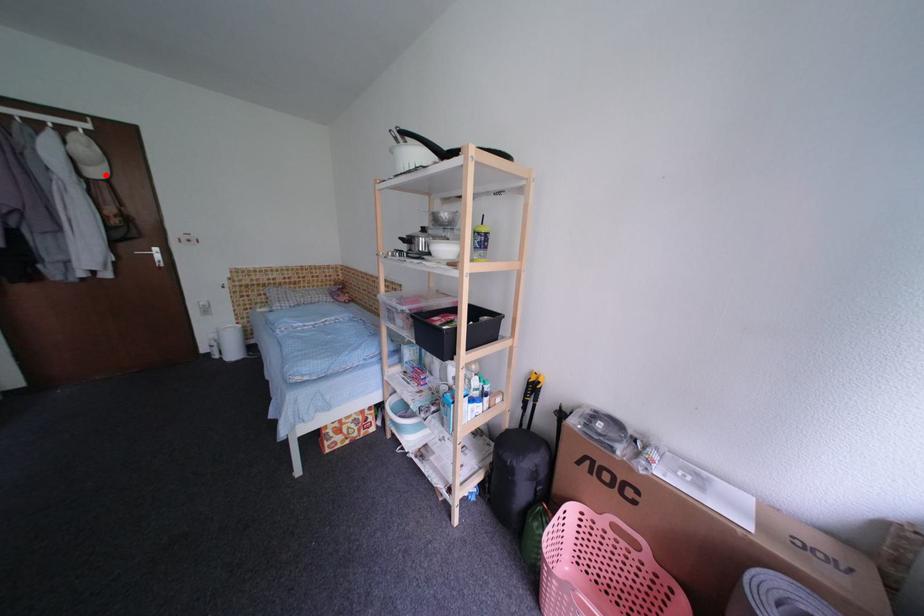
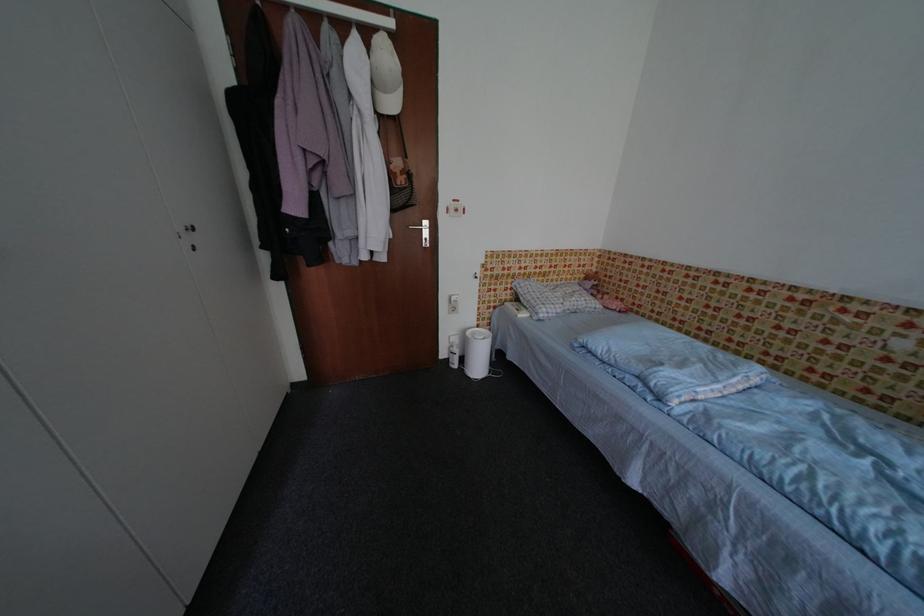
Find the pixel in the second image that matches the highlighted location in the first image.

(400, 107)